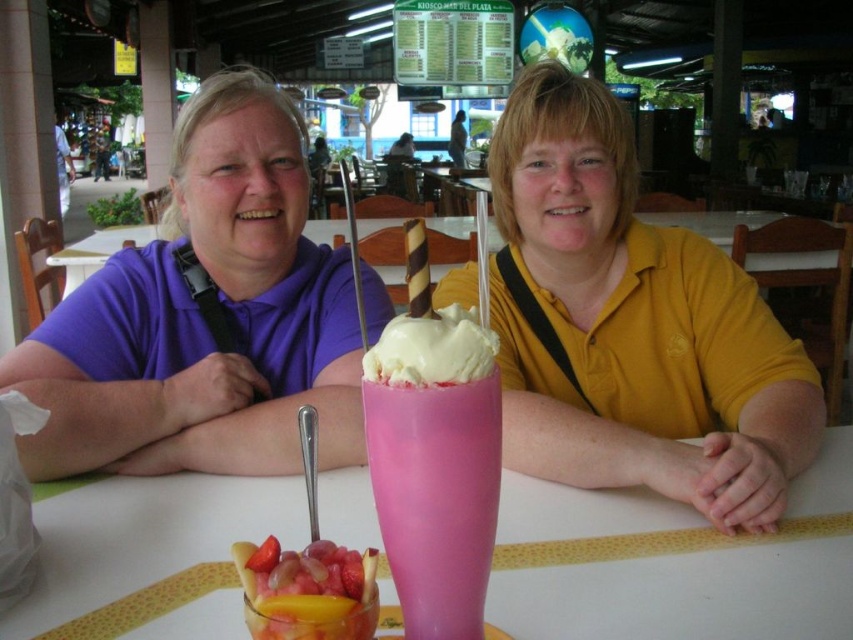
Question: Can you confirm if pink glass milkshake at center is smaller than whipped cream at center?

Choices:
 (A) no
 (B) yes

Answer: (A)

Question: Can you confirm if purple matte shirt at center is thinner than pink plastic cup at center?

Choices:
 (A) no
 (B) yes

Answer: (A)

Question: Is purple matte shirt at center behind translucent glass at center?

Choices:
 (A) yes
 (B) no

Answer: (A)

Question: Which point is farther to the camera?

Choices:
 (A) pink plastic cup at center
 (B) pink glass milkshake at center

Answer: (B)

Question: Which object appears closest to the camera in this image?

Choices:
 (A) pink glass milkshake at center
 (B) whipped cream at center

Answer: (B)

Question: Which of these objects is positioned farthest from the glossy plastic fruit salad at center?

Choices:
 (A) yellow matte shirt at center
 (B) whipped cream at center

Answer: (A)